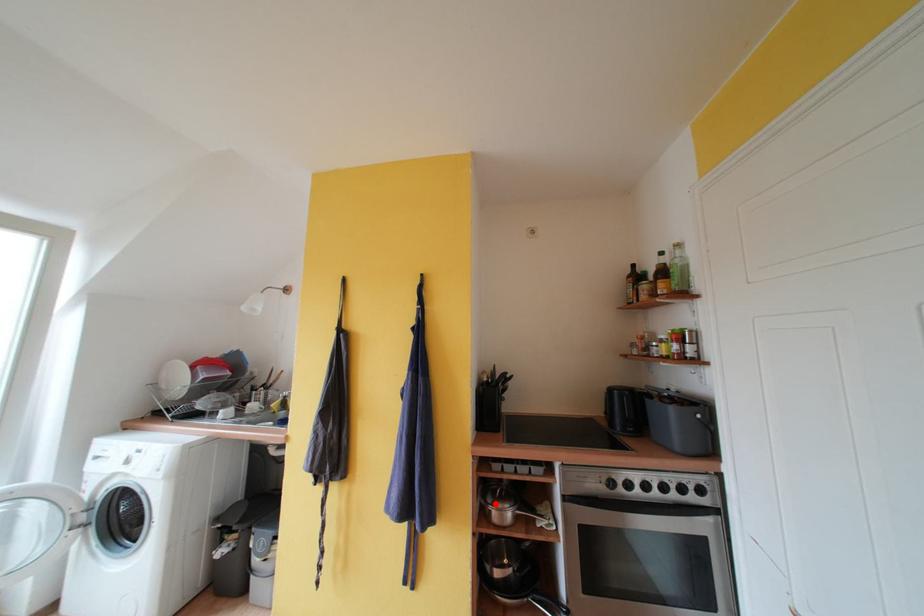
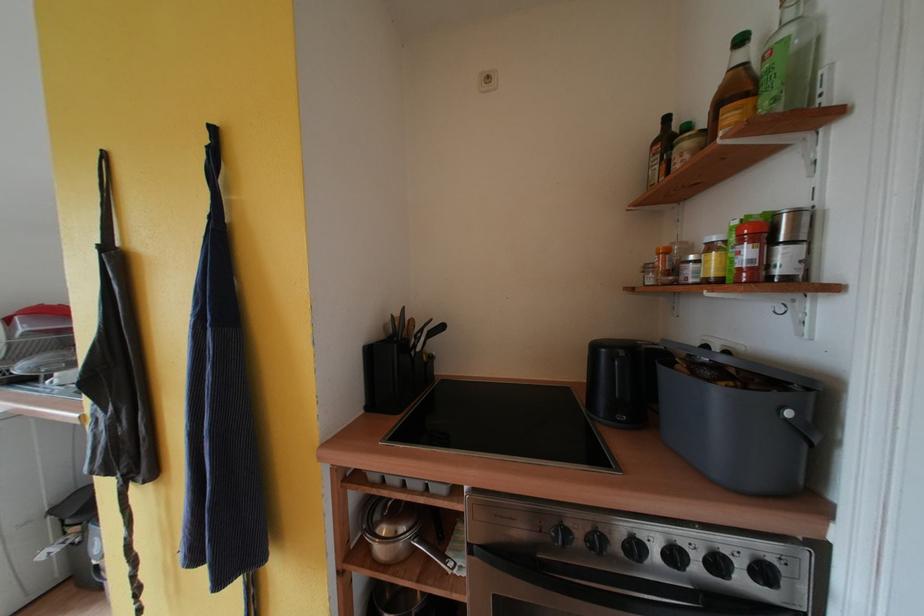
Question: I am providing you with two images of the same scene from different viewpoints. Given a red point in image1, look at the same physical point in image2. Is it:

Choices:
 (A) Closer to the viewpoint
 (B) Farther from the viewpoint

Answer: (A)